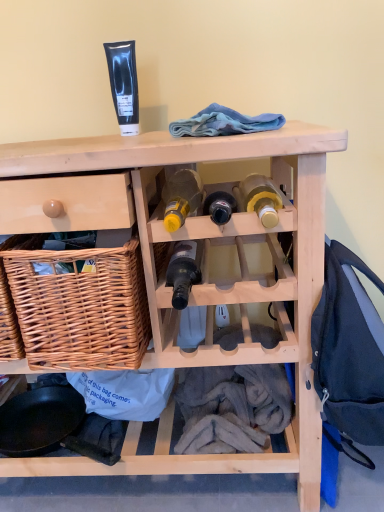
In order to click on vacant area that lies in front of blue fleece at upper center, positioned as the first clothing in top-to-bottom order in this screenshot , I will do `click(242, 136)`.